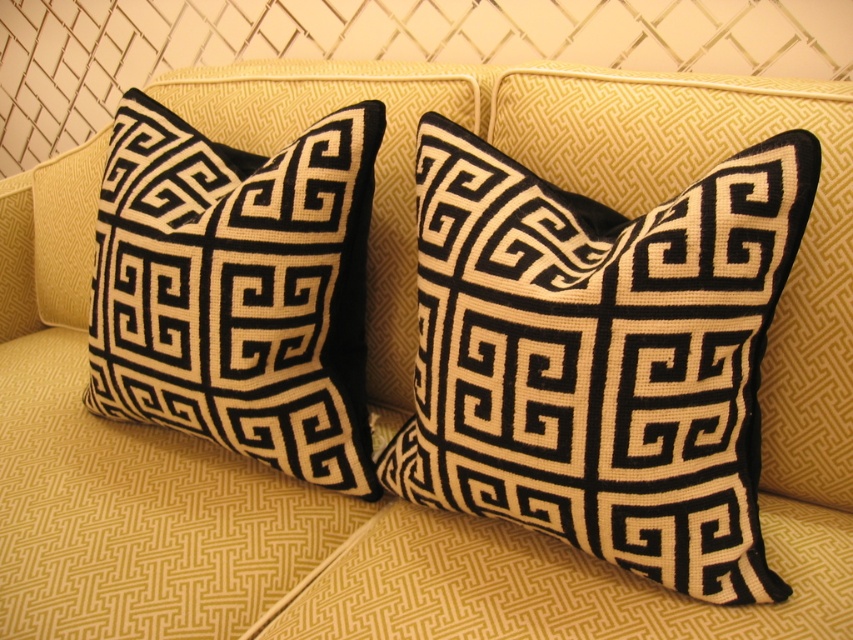
You are standing in front of a sofa with two decorative pillows. You need to place a small vase between the two points labeled as point (540, 216) and point (293, 259). Which point should the vase be closer to if it needs to be positioned in front of the other point?

The vase should be closer to point (540, 216) because it is in front of point (293, 259).

You are arranging a sofa for a client who prefers symmetry. You have two black velvet pillows. The client wants to know if the black velvet pillow at center and the black velvet pillow at left are the same height. Based on the scene, what should you tell them?

The black velvet pillow at center is not as tall as the black velvet pillow at left, so they are not the same height.

You are standing in a living room and see the sofa with a black velvet pillow at center. There is a point marked at coordinates (601, 356). Based on the scene description, can you determine if this point is located on the sofa or on the black velvet pillow at center?

The point (601, 356) is on the black velvet pillow at center, so yes, the point is located on the black velvet pillow at center.